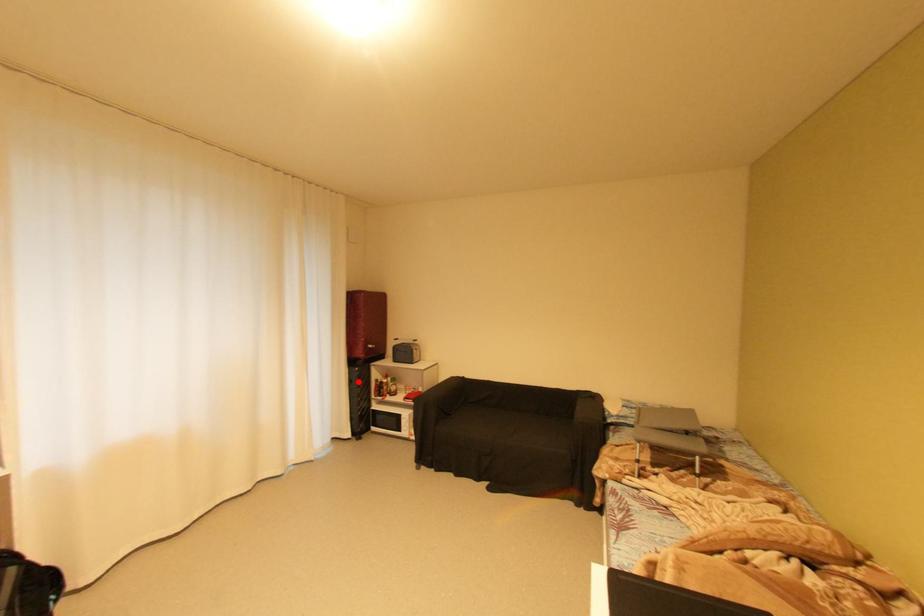
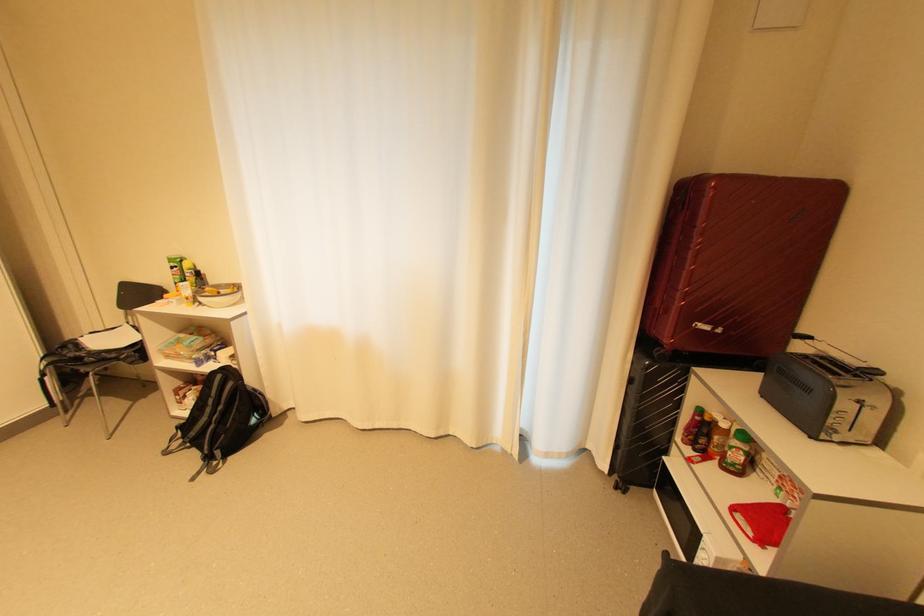
Question: I am providing you with two images of the same scene from different viewpoints. A red point is marked on the first image. At the location where the point appears in image 1, is it still visible in image 2?

Choices:
 (A) Yes
 (B) No

Answer: (A)